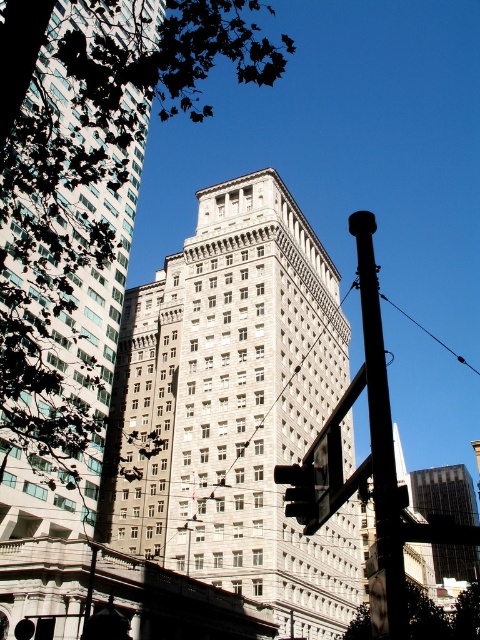
Question: Does white stone building at center have a lesser width compared to matte black traffic light at center?

Choices:
 (A) no
 (B) yes

Answer: (A)

Question: Which point is closer to the camera?

Choices:
 (A) green leafy tree at upper left
 (B) white stone building at center
 (C) green leafy tree at lower right
 (D) matte black traffic light at center

Answer: (A)

Question: Is gray concrete skyscraper at center thinner than green leafy tree at lower right?

Choices:
 (A) yes
 (B) no

Answer: (B)

Question: Is white stone building at center behind gray concrete skyscraper at center?

Choices:
 (A) yes
 (B) no

Answer: (A)

Question: Among these points, which one is nearest to the camera?

Choices:
 (A) (381, 348)
 (B) (462, 598)

Answer: (A)

Question: Which object appears farthest from the camera in this image?

Choices:
 (A) matte black traffic light at center
 (B) metallic pole at center
 (C) green leafy tree at lower right
 (D) gray concrete skyscraper at center

Answer: (A)